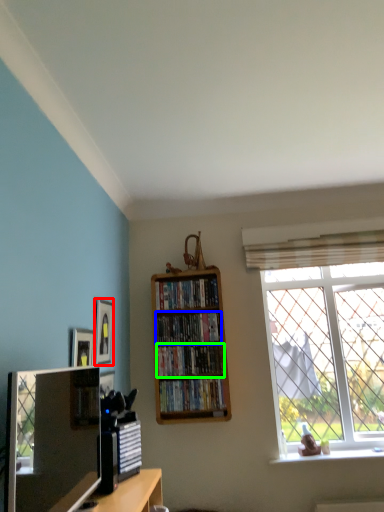
Question: Considering the real-world distances, which object is closest to picture frame (highlighted by a red box)? book (highlighted by a blue box) or book (highlighted by a green box).

Choices:
 (A) book
 (B) book

Answer: (A)